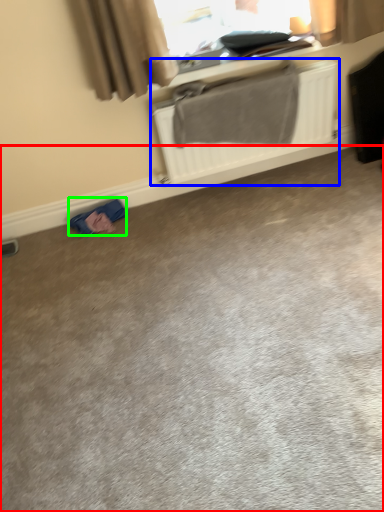
Question: Considering the real-world distances, which object is farthest from concrete (highlighted by a red box)? radiator (highlighted by a blue box) or material (highlighted by a green box)?

Choices:
 (A) radiator
 (B) material

Answer: (A)